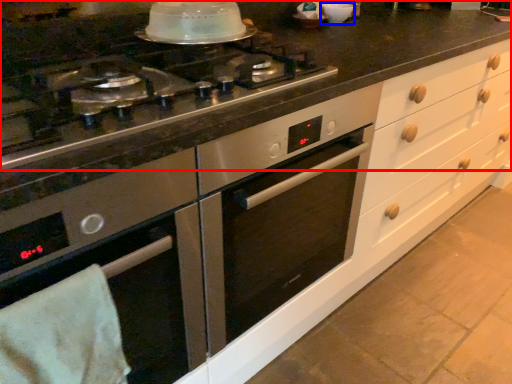
Question: Which point is further to the camera, countertop (highlighted by a red box) or appliance (highlighted by a blue box)?

Choices:
 (A) countertop
 (B) appliance

Answer: (B)